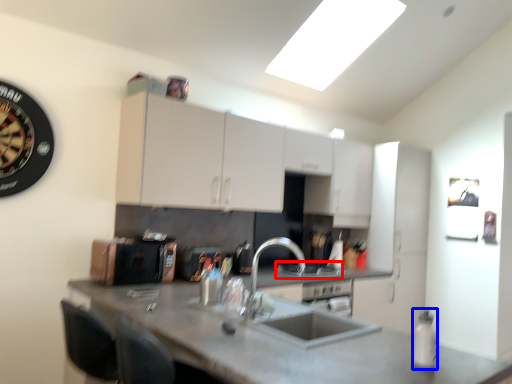
Question: Which object appears closest to the camera in this image, gas stove (highlighted by a red box) or bottle (highlighted by a blue box)?

Choices:
 (A) gas stove
 (B) bottle

Answer: (B)